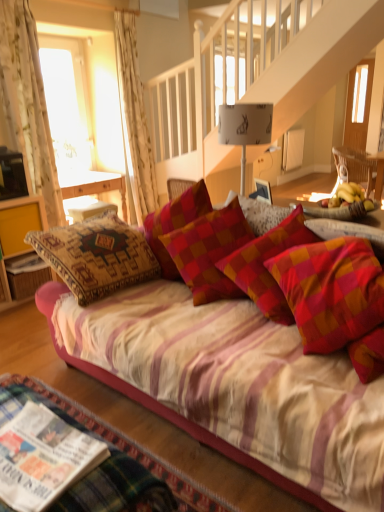
You are a GUI agent. You are given a task and a screenshot of the screen. Output one action in this format:
    pyautogui.click(x=<x>, y=<y>)
    Task: Click on the silky pink couch at center
    The width and height of the screenshot is (384, 512).
    Given the screenshot: What is the action you would take?
    pyautogui.click(x=235, y=386)

What do you see at coordinates (209, 251) in the screenshot?
I see `plaid fabric pillow at center` at bounding box center [209, 251].

What do you see at coordinates (28, 103) in the screenshot? This screenshot has height=512, width=384. I see `white floral fabric curtain at left, which is counted as the second curtain, starting from the right` at bounding box center [28, 103].

In order to click on wooden chair at right in this screenshot , I will do `click(361, 168)`.

Which object is positioned more to the left, white floral fabric curtain at left, which is counted as the second curtain, starting from the right, or pink fabric bed frame at lower left?

white floral fabric curtain at left, which is counted as the second curtain, starting from the right.

Is white floral fabric curtain at left, positioned as the second curtain in back-to-front order, located outside pink fabric bed frame at lower left?

Yes, white floral fabric curtain at left, positioned as the second curtain in back-to-front order, is located beyond the bounds of pink fabric bed frame at lower left.

How different are the orientations of white floral fabric curtain at left, positioned as the second curtain in back-to-front order, and pink fabric bed frame at lower left in degrees?

They differ by 90.6 degrees in their facing directions.

Consider the image. Is silky pink couch at center with plaid fabric pillow at center?

There is a gap between silky pink couch at center and plaid fabric pillow at center.

Is silky pink couch at center taller than plaid fabric pillow at center?

Indeed, silky pink couch at center has a greater height compared to plaid fabric pillow at center.

Based on their sizes in the image, would you say silky pink couch at center is bigger or smaller than plaid fabric pillow at center?

silky pink couch at center is bigger than plaid fabric pillow at center.

Could you tell me if silky pink couch at center is turned towards plaid fabric pillow at center?

No, silky pink couch at center is not facing towards plaid fabric pillow at center.

From the image's perspective, is printed paper magazine at lower left, the 2th magazine when ordered from left to right, under white floral fabric curtain at upper left, which ranks as the 1th curtain in right-to-left order?

Yes, from the image's perspective, printed paper magazine at lower left, the 2th magazine when ordered from left to right, is beneath white floral fabric curtain at upper left, which ranks as the 1th curtain in right-to-left order.

From a real-world perspective, is printed paper magazine at lower left, arranged as the 2th magazine when viewed from the top, physically below white floral fabric curtain at upper left, the second curtain viewed from the left?

Correct, in the physical world, printed paper magazine at lower left, arranged as the 2th magazine when viewed from the top, is lower than white floral fabric curtain at upper left, the second curtain viewed from the left.

The image size is (384, 512). I want to click on the 2nd magazine below the white floral fabric curtain at upper left, which ranks as the 1th curtain in right-to-left order (from the image's perspective), so click(43, 458).

Is printed paper magazine at lower left, which is counted as the second magazine, starting from the back, wider or thinner than white floral fabric curtain at upper left, the first curtain when ordered from back to front?

In the image, printed paper magazine at lower left, which is counted as the second magazine, starting from the back, appears to be wider than white floral fabric curtain at upper left, the first curtain when ordered from back to front.

From a real-world perspective, between printed paper magazine at lower left, which is counted as the second magazine, starting from the back, and white paper lampshade at upper center, who is vertically higher?

In real-world perspective, white paper lampshade at upper center is above.

Is printed paper magazine at lower left, arranged as the 2th magazine when viewed from the top, wider than white paper lampshade at upper center?

→ Correct, the width of printed paper magazine at lower left, arranged as the 2th magazine when viewed from the top, exceeds that of white paper lampshade at upper center.

From the image's perspective, is printed paper magazine at lower left, placed as the first magazine when sorted from bottom to top, positioned above or below white paper lampshade at upper center?

printed paper magazine at lower left, placed as the first magazine when sorted from bottom to top, is below white paper lampshade at upper center.

Which is correct: printed paper magazine at lower left, the 2th magazine when ordered from left to right, is inside white paper lampshade at upper center, or outside of it?

printed paper magazine at lower left, the 2th magazine when ordered from left to right, exists outside the volume of white paper lampshade at upper center.

Is there a large distance between white paper lampshade at upper center and white glossy magazine at lower left, arranged as the 2th magazine when viewed from the front?

Yes, white paper lampshade at upper center is far from white glossy magazine at lower left, arranged as the 2th magazine when viewed from the front.

Between point (265, 106) and point (24, 264), which one is positioned in front?

The point (265, 106) is in front.

Can we say white paper lampshade at upper center lies outside white glossy magazine at lower left, arranged as the first magazine when viewed from the back?

Yes, white paper lampshade at upper center is outside of white glossy magazine at lower left, arranged as the first magazine when viewed from the back.

This screenshot has height=512, width=384. Find the location of `chair lying behind the printed paper magazine at lower left, which ranks as the 1th magazine in front-to-back order`. chair lying behind the printed paper magazine at lower left, which ranks as the 1th magazine in front-to-back order is located at coordinates (361, 168).

Is printed paper magazine at lower left, which ranks as the 1th magazine in front-to-back order, oriented away from wooden chair at right?

Correct, printed paper magazine at lower left, which ranks as the 1th magazine in front-to-back order, is looking away from wooden chair at right.

Considering the sizes of printed paper magazine at lower left, placed as the first magazine when sorted from bottom to top, and wooden chair at right in the image, is printed paper magazine at lower left, placed as the first magazine when sorted from bottom to top, wider or thinner than wooden chair at right?

In the image, printed paper magazine at lower left, placed as the first magazine when sorted from bottom to top, appears to be more narrow than wooden chair at right.

From a real-world perspective, who is located lower, printed paper magazine at lower left, which is counted as the second magazine, starting from the back, or wooden chair at right?

In real-world perspective, printed paper magazine at lower left, which is counted as the second magazine, starting from the back, is lower.

Which object is more forward, plaid fabric pillow at center or white floral fabric curtain at left, which appears as the 1th curtain when viewed from the left?

plaid fabric pillow at center.

Who is smaller, plaid fabric pillow at center or white floral fabric curtain at left, positioned as the second curtain in back-to-front order?

plaid fabric pillow at center.

Which of these two, plaid fabric pillow at center or white floral fabric curtain at left, the first curtain viewed from the front, stands shorter?

Standing shorter between the two is plaid fabric pillow at center.

Can you tell me how much plaid fabric pillow at center and white floral fabric curtain at left, which is counted as the second curtain, starting from the right, differ in facing direction?

The facing directions of plaid fabric pillow at center and white floral fabric curtain at left, which is counted as the second curtain, starting from the right, are 79.7 degrees apart.

From a real-world perspective, which curtain is the 2nd one above the pink fabric bed frame at lower left? Please provide its 2D coordinates.

[(28, 103)]

Where is `pillow lying behind the silky pink couch at center`? This screenshot has height=512, width=384. pillow lying behind the silky pink couch at center is located at coordinates (209, 251).

Considering their positions, is wooden chair at right positioned further to printed paper magazine at lower left, which ranks as the 1th magazine in front-to-back order, than pink fabric bed frame at lower left?

wooden chair at right lies further to printed paper magazine at lower left, which ranks as the 1th magazine in front-to-back order, than the other object.

From the image, which object appears to be farther from white floral fabric curtain at upper left, the first curtain when ordered from back to front, white paper lampshade at upper center or wooden chair at right?

Based on the image, wooden chair at right appears to be further to white floral fabric curtain at upper left, the first curtain when ordered from back to front.

Which object lies nearer to the anchor point white floral fabric curtain at left, positioned as the second curtain in back-to-front order, wooden chair at right or yellow wood cabinet at left?

Among the two, yellow wood cabinet at left is located nearer to white floral fabric curtain at left, positioned as the second curtain in back-to-front order.

Based on their spatial positions, is pink fabric bed frame at lower left or wooden chair at right further from yellow wood cabinet at left?

wooden chair at right is positioned further to the anchor yellow wood cabinet at left.

Considering their positions, is white paper lampshade at upper center positioned closer to printed paper magazine at lower left, the 2th magazine when ordered from left to right, than white floral fabric curtain at left, which appears as the 1th curtain when viewed from the left?

Among the two, white paper lampshade at upper center is located nearer to printed paper magazine at lower left, the 2th magazine when ordered from left to right.

Consider the image. When comparing their distances from silky pink couch at center, does plaid fabric pillow at center or printed paper magazine at lower left, the 2th magazine when ordered from left to right, seem closer?

Among the two, plaid fabric pillow at center is located nearer to silky pink couch at center.

Based on their spatial positions, is plaid fabric pillow at center or white floral fabric curtain at left, positioned as the second curtain in back-to-front order, closer to wooden chair at right?

plaid fabric pillow at center is closer to wooden chair at right.

From the image, which object appears to be farther from pink fabric bed frame at lower left, printed paper magazine at lower left, arranged as the 2th magazine when viewed from the top, or white floral fabric curtain at upper left, the second curtain viewed from the left?

white floral fabric curtain at upper left, the second curtain viewed from the left, is positioned further to the anchor pink fabric bed frame at lower left.

Where is `magazine between pink fabric bed frame at lower left and white glossy magazine at lower left, the first magazine from the top, from front to back`? magazine between pink fabric bed frame at lower left and white glossy magazine at lower left, the first magazine from the top, from front to back is located at coordinates (43, 458).

At what (x,y) coordinates should I click in order to perform the action: click on curtain located between silky pink couch at center and yellow wood cabinet at left in the depth direction. Please return your answer as a coordinate pair (x, y). The width and height of the screenshot is (384, 512). Looking at the image, I should click on (28, 103).

Identify the location of pillow positioned between printed paper magazine at lower left, arranged as the 2th magazine when viewed from the top, and white floral fabric curtain at upper left, the first curtain when ordered from back to front, from near to far. The image size is (384, 512). (209, 251).

Locate an element on the screen. Image resolution: width=384 pixels, height=512 pixels. pillow positioned between printed paper magazine at lower left, the 2th magazine when ordered from left to right, and white paper lampshade at upper center from near to far is located at coordinates (209, 251).